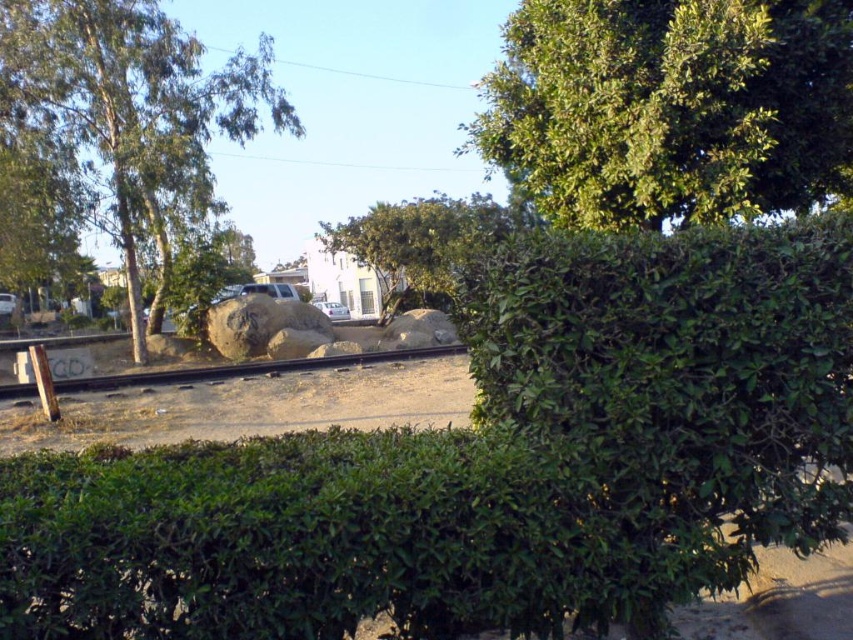
You are a pedestrian standing on the sidewalk next to the green leafy tree at center and the white matte car at center. Which object is higher from the ground?

The green leafy tree at center is located above the white matte car at center, so the green leafy tree at center is higher from the ground.